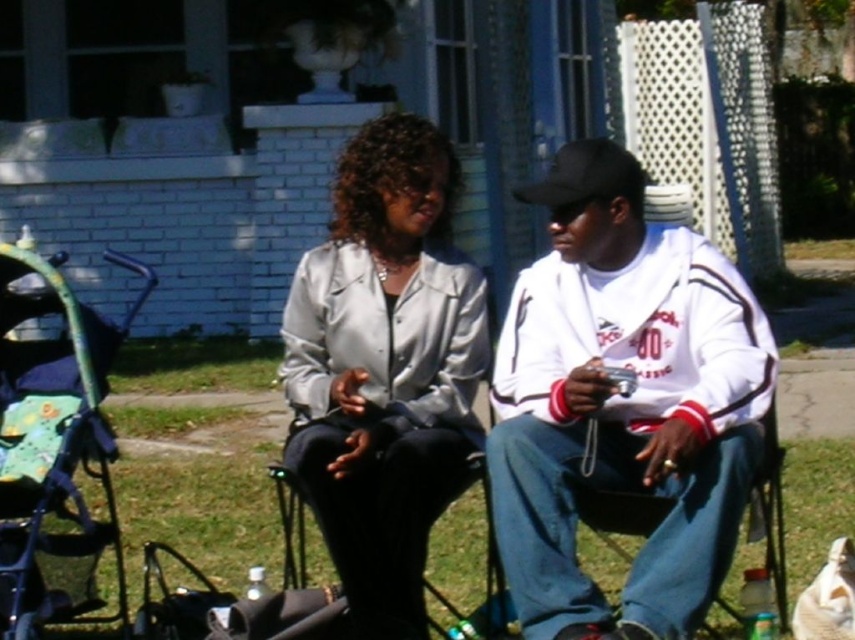
You are a fashion designer observing two jackets displayed in a store window. The jackets are the white fleece jacket at center and the satin silver jacket at center. Which jacket is placed lower in the display?

The white fleece jacket at center is positioned under the satin silver jacket at center, so it is placed lower in the display.

You are standing at the viewpoint of the image and want to place a small garden statue exactly 5 meters away from the point at coordinates point (690,355). Is this feasible?

The distance between point (690,355) and the viewer is 5.31 meters. Since 5 meters is slightly less than this distance, placing the statue exactly 5 meters away from point (690,355) would require positioning it closer to the viewer than the current point, which is possible.

Please provide the 2D coordinates of the white fleece jacket at center in the image. The answer should be in the format of coordinates in parentheses.

The 2D coordinates of the white fleece jacket at center are at point (623, 403).